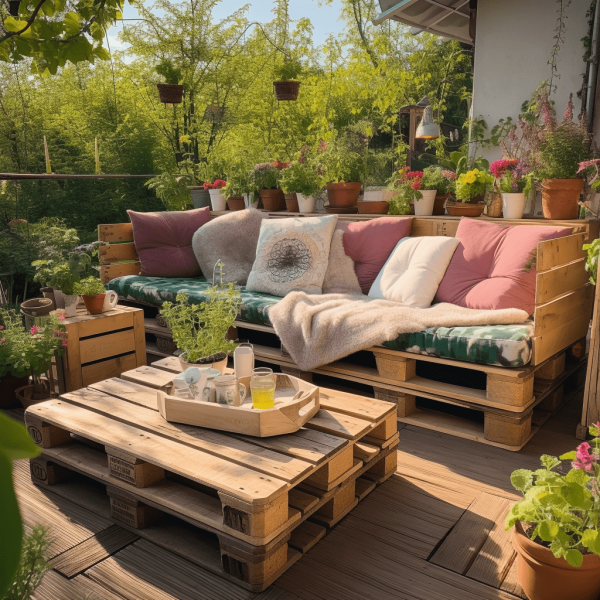
Find the location of a particular element. The image size is (600, 600). teal tie dye couch pad is located at coordinates (485, 348).